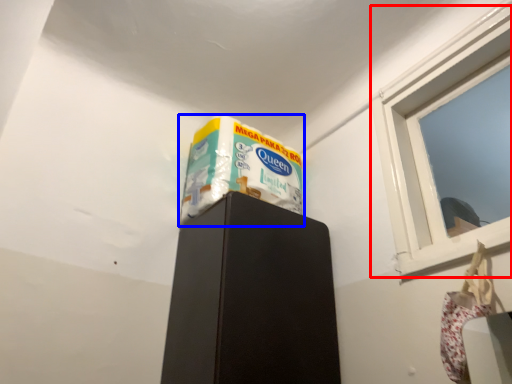
Question: Which object appears closest to the camera in this image, window (highlighted by a red box) or wrapping paper (highlighted by a blue box)?

Choices:
 (A) window
 (B) wrapping paper

Answer: (A)